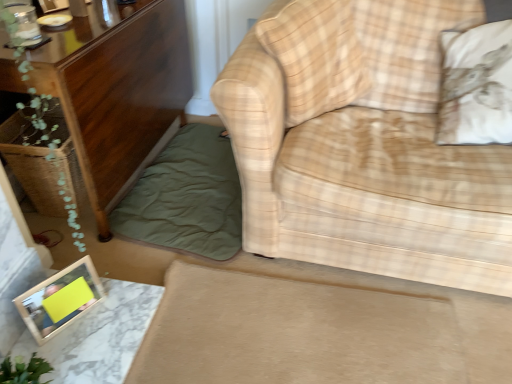
Question: Can you confirm if green cotton blanket at lower left is thinner than plaid fabric pillow at center, which ranks as the first pillow in left-to-right order?

Choices:
 (A) no
 (B) yes

Answer: (A)

Question: Can you confirm if green cotton blanket at lower left is taller than plaid fabric pillow at center, which ranks as the first pillow in left-to-right order?

Choices:
 (A) no
 (B) yes

Answer: (A)

Question: Is green cotton blanket at lower left positioned behind plaid fabric pillow at center, the second pillow in the right-to-left sequence?

Choices:
 (A) yes
 (B) no

Answer: (A)

Question: Is the position of green cotton blanket at lower left less distant than that of plaid fabric pillow at center, which ranks as the first pillow in left-to-right order?

Choices:
 (A) yes
 (B) no

Answer: (B)

Question: Does green cotton blanket at lower left have a greater width compared to plaid fabric pillow at center, the second pillow in the right-to-left sequence?

Choices:
 (A) no
 (B) yes

Answer: (B)

Question: Is wooden cabinet at left situated inside beige plaid fabric couch at right or outside?

Choices:
 (A) inside
 (B) outside

Answer: (B)

Question: Based on their positions, is wooden cabinet at left located to the left or right of beige plaid fabric couch at right?

Choices:
 (A) right
 (B) left

Answer: (B)

Question: In terms of height, does wooden cabinet at left look taller or shorter compared to beige plaid fabric couch at right?

Choices:
 (A) short
 (B) tall

Answer: (A)

Question: Is point (160, 109) positioned closer to the camera than point (407, 66)?

Choices:
 (A) closer
 (B) farther

Answer: (B)

Question: Is beige plaid fabric couch at right bigger or smaller than green cotton blanket at lower left?

Choices:
 (A) big
 (B) small

Answer: (A)

Question: Considering the relative positions of beige plaid fabric couch at right and green cotton blanket at lower left in the image provided, is beige plaid fabric couch at right to the left or to the right of green cotton blanket at lower left?

Choices:
 (A) right
 (B) left

Answer: (A)

Question: Does point (349, 21) appear closer or farther from the camera than point (182, 228)?

Choices:
 (A) closer
 (B) farther

Answer: (A)

Question: Considering the positions of beige plaid fabric couch at right and green cotton blanket at lower left in the image, is beige plaid fabric couch at right taller or shorter than green cotton blanket at lower left?

Choices:
 (A) short
 (B) tall

Answer: (B)

Question: In terms of height, does white cotton pillow at upper right, arranged as the second pillow when viewed from the left, look taller or shorter compared to beige plaid fabric couch at right?

Choices:
 (A) short
 (B) tall

Answer: (A)

Question: Relative to beige plaid fabric couch at right, is white cotton pillow at upper right, which is counted as the first pillow, starting from the right, in front or behind?

Choices:
 (A) behind
 (B) front

Answer: (A)